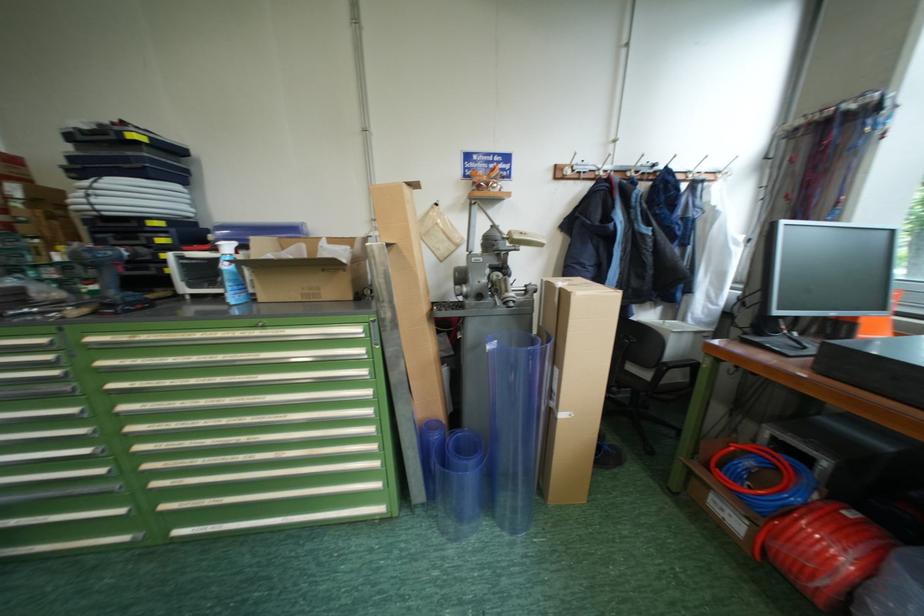
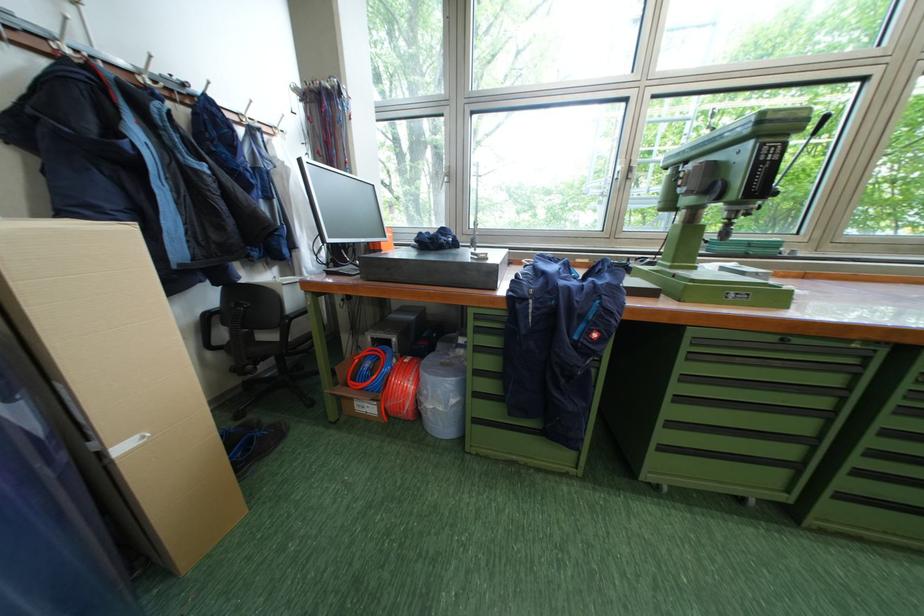
The point at (685, 333) is marked in the first image. Where is the corresponding point in the second image?

(295, 285)